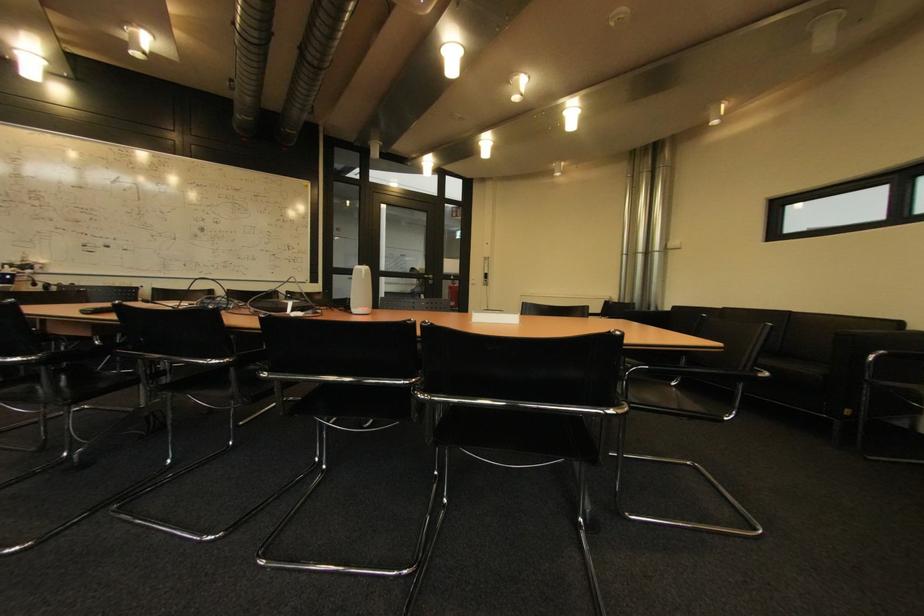
Where would you resting arm the chrome chair armrest? Please return your answer as a coordinate pair (x, y).

(21, 354)